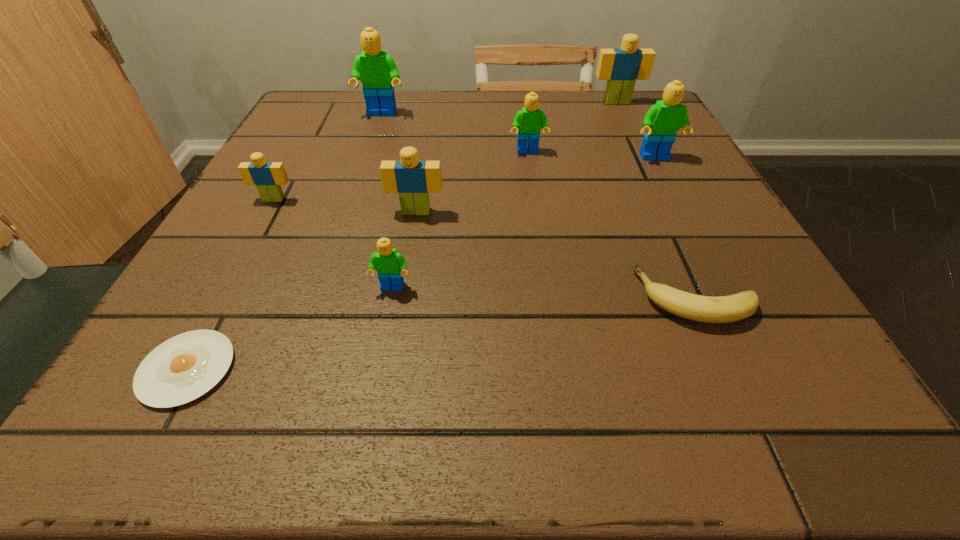
Where is `the smallest beige Lego`? Image resolution: width=960 pixels, height=540 pixels. the smallest beige Lego is located at coordinates (268, 177).

The height and width of the screenshot is (540, 960). I want to click on the nearest Lego, so click(389, 264).

Find the location of a particular element. the smallest green Lego is located at coordinates (389, 264).

What are the coordinates of `the second shortest object` in the screenshot? It's located at (724, 309).

This screenshot has width=960, height=540. What are the coordinates of `yellow banana` in the screenshot? It's located at (724, 309).

Find the location of a particular element. white egg yolk is located at coordinates (183, 368).

This screenshot has height=540, width=960. I want to click on egg yolk, so click(183, 368).

I want to click on free space located 0.280m on the face of the tallest Lego, so click(x=356, y=192).

At what (x,y) coordinates should I click in order to perform the action: click on free region located 0.230m on the face of the farthest beige Lego. Please return your answer as a coordinate pair (x, y). Looking at the image, I should click on (643, 157).

This screenshot has width=960, height=540. In order to click on vacant position located on the face of the rightmost green Lego in this screenshot , I will do `click(735, 314)`.